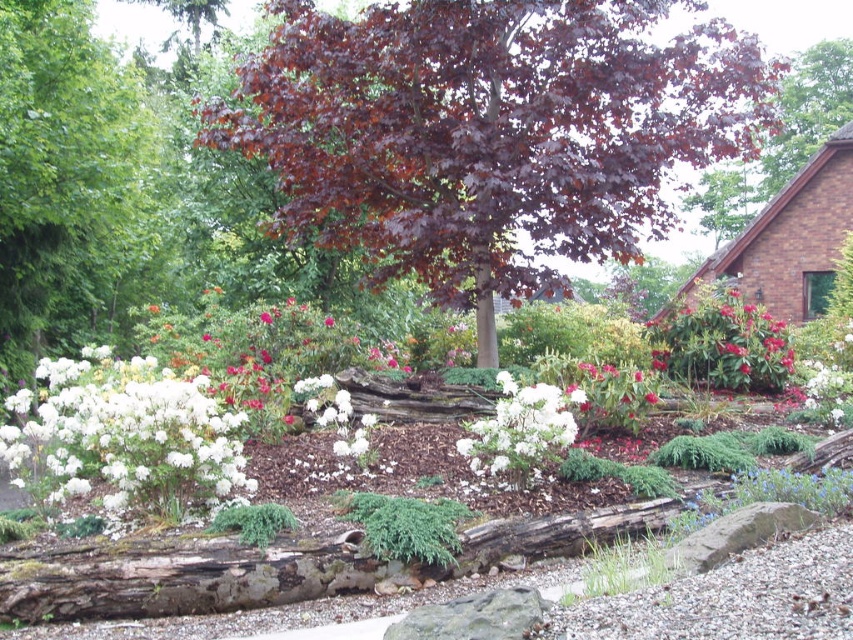
Question: Does dark red wood at upper right appear over green textured bush at center?

Choices:
 (A) yes
 (B) no

Answer: (A)

Question: Which of the following is the farthest from the observer?

Choices:
 (A) gray rough rock at lower center
 (B) dark purple leafy tree at center

Answer: (B)

Question: Observing the image, what is the correct spatial positioning of dark purple leafy tree at center in reference to dark red wood at upper right?

Choices:
 (A) above
 (B) below

Answer: (B)

Question: Which point is farther to the camera?

Choices:
 (A) (148, 388)
 (B) (500, 154)

Answer: (B)

Question: Is white fluffy bush at center wider than gray rough rock at lower center?

Choices:
 (A) no
 (B) yes

Answer: (B)

Question: Which object is positioned farthest from the dark red wood at upper right?

Choices:
 (A) dark purple leafy tree at center
 (B) green textured bush at center
 (C) white fluffy bush at lower left
 (D) white fluffy bush at center

Answer: (C)